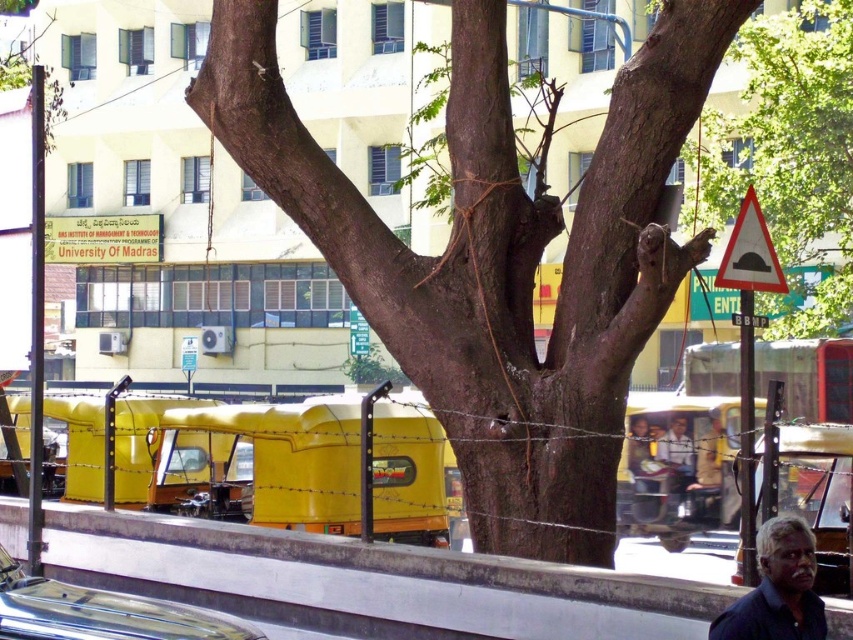
Question: Is green rough bark tree at upper right positioned before dark blue shirt at center?

Choices:
 (A) yes
 (B) no

Answer: (A)

Question: Among these objects, which one is farthest from the camera?

Choices:
 (A) dark blue shirt at center
 (B) shiny metallic car at lower center
 (C) white concrete pavement at lower center

Answer: (A)

Question: Is brown rough bark tree at center below shiny metallic car at lower center?

Choices:
 (A) no
 (B) yes

Answer: (A)

Question: Which point is farther from the camera taking this photo?

Choices:
 (A) (50, 637)
 (B) (239, 580)

Answer: (B)

Question: Among these objects, which one is farthest from the camera?

Choices:
 (A) shiny metallic car at lower center
 (B) brown rough bark tree at center
 (C) white concrete pavement at lower center

Answer: (B)

Question: Does white concrete pavement at lower center appear over dark blue shirt at lower right?

Choices:
 (A) yes
 (B) no

Answer: (B)